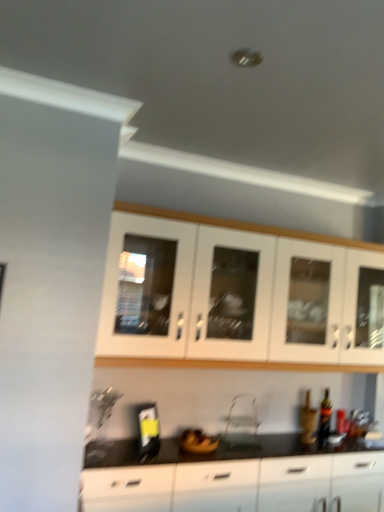
Question: Is white glass cabinet at upper center, placed as the second cabinetry when sorted from bottom to top, looking in the opposite direction of black glossy cabinet at lower center, the second cabinetry in the top-to-bottom sequence?

Choices:
 (A) no
 (B) yes

Answer: (A)

Question: From the image's perspective, does white glass cabinet at upper center, placed as the second cabinetry when sorted from bottom to top, appear lower than black glossy cabinet at lower center, the second cabinetry in the top-to-bottom sequence?

Choices:
 (A) yes
 (B) no

Answer: (B)

Question: Does white glass cabinet at upper center, which is the 1th cabinetry from top to bottom, touch black glossy cabinet at lower center, the second cabinetry in the top-to-bottom sequence?

Choices:
 (A) no
 (B) yes

Answer: (A)

Question: Can you confirm if white glass cabinet at upper center, placed as the second cabinetry when sorted from bottom to top, is positioned to the left of black glossy cabinet at lower center, the second cabinetry in the top-to-bottom sequence?

Choices:
 (A) yes
 (B) no

Answer: (B)

Question: Is the depth of white glass cabinet at upper center, which is the 1th cabinetry from top to bottom, less than that of black glossy cabinet at lower center, the second cabinetry in the top-to-bottom sequence?

Choices:
 (A) no
 (B) yes

Answer: (A)

Question: Based on their sizes in the image, would you say clear plastic folding chair at center is bigger or smaller than white glass cabinet at upper center, placed as the second cabinetry when sorted from bottom to top?

Choices:
 (A) small
 (B) big

Answer: (A)

Question: Considering the positions of clear plastic folding chair at center and white glass cabinet at upper center, placed as the second cabinetry when sorted from bottom to top, in the image, is clear plastic folding chair at center taller or shorter than white glass cabinet at upper center, placed as the second cabinetry when sorted from bottom to top,?

Choices:
 (A) short
 (B) tall

Answer: (A)

Question: From the image's perspective, is clear plastic folding chair at center above or below white glass cabinet at upper center, which is the 1th cabinetry from top to bottom?

Choices:
 (A) above
 (B) below

Answer: (B)

Question: Which is correct: clear plastic folding chair at center is inside white glass cabinet at upper center, which is the 1th cabinetry from top to bottom, or outside of it?

Choices:
 (A) inside
 (B) outside

Answer: (B)

Question: Considering the positions of matte glass bottle at lower right and white glass cabinet at upper center, which is the 1th cabinetry from top to bottom, in the image, is matte glass bottle at lower right taller or shorter than white glass cabinet at upper center, which is the 1th cabinetry from top to bottom,?

Choices:
 (A) tall
 (B) short

Answer: (B)

Question: Is matte glass bottle at lower right to the left or to the right of white glass cabinet at upper center, placed as the second cabinetry when sorted from bottom to top, in the image?

Choices:
 (A) left
 (B) right

Answer: (B)

Question: Is matte glass bottle at lower right wider or thinner than white glass cabinet at upper center, which is the 1th cabinetry from top to bottom?

Choices:
 (A) thin
 (B) wide

Answer: (A)

Question: From the image's perspective, is matte glass bottle at lower right above or below white glass cabinet at upper center, which is the 1th cabinetry from top to bottom?

Choices:
 (A) above
 (B) below

Answer: (B)

Question: Based on their positions, is matte glass bottle at lower right located to the left or right of clear plastic folding chair at center?

Choices:
 (A) right
 (B) left

Answer: (A)

Question: Considering the positions of matte glass bottle at lower right and clear plastic folding chair at center in the image, is matte glass bottle at lower right wider or thinner than clear plastic folding chair at center?

Choices:
 (A) wide
 (B) thin

Answer: (B)